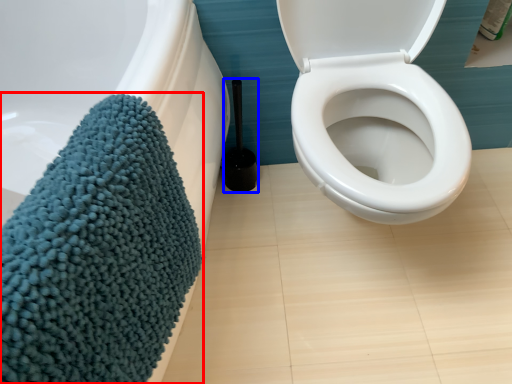
Question: Which object appears farthest to the camera in this image, bath towel (highlighted by a red box) or brush (highlighted by a blue box)?

Choices:
 (A) bath towel
 (B) brush

Answer: (B)